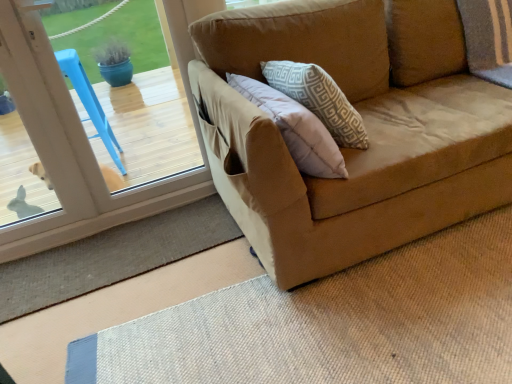
I want to click on burlap mat at lower left, so click(112, 256).

Describe the element at coordinates (112, 256) in the screenshot. I see `burlap mat at lower left` at that location.

This screenshot has width=512, height=384. Describe the element at coordinates (149, 127) in the screenshot. I see `transparent glass door at left` at that location.

Locate an element on the screen. transparent glass door at left is located at coordinates (149, 127).

Locate an element on the screen. burlap mat at lower left is located at coordinates (112, 256).

Considering the positions of objects transparent glass door at left and burlap mat at lower left in the image provided, who is more to the left, transparent glass door at left or burlap mat at lower left?

burlap mat at lower left is more to the left.

Is transparent glass door at left behind burlap mat at lower left?

No, the depth of transparent glass door at left is less than that of burlap mat at lower left.

Does point (165, 160) appear closer or farther from the camera than point (148, 232)?

Point (165, 160) appears to be farther away from the viewer than point (148, 232).

From the image's perspective, which one is positioned lower, transparent glass door at left or burlap mat at lower left?

burlap mat at lower left appears lower in the image.

From a real-world perspective, between transparent glass door at left and burlap mat at lower left, who is vertically lower?

burlap mat at lower left is physically lower.

Considering the relative sizes of transparent glass door at left and burlap mat at lower left in the image provided, is transparent glass door at left thinner than burlap mat at lower left?

Yes, transparent glass door at left is thinner than burlap mat at lower left.

Can you confirm if transparent glass door at left is shorter than burlap mat at lower left?

No, transparent glass door at left is not shorter than burlap mat at lower left.

Who is bigger, transparent glass door at left or burlap mat at lower left?

Bigger between the two is transparent glass door at left.

Consider the image. Do you think transparent glass door at left is within burlap mat at lower left, or outside of it?

transparent glass door at left is not inside burlap mat at lower left, it's outside.

Is transparent glass door at left far away from burlap mat at lower left?

No, there isn't a large distance between transparent glass door at left and burlap mat at lower left.

Is transparent glass door at left facing towards burlap mat at lower left?

Yes.

How many degrees apart are the facing directions of transparent glass door at left and burlap mat at lower left?

There is a 2-degree angle between the facing directions of transparent glass door at left and burlap mat at lower left.

Measure the distance from transparent glass door at left to burlap mat at lower left.

The distance of transparent glass door at left from burlap mat at lower left is 33.00 inches.

At what (x,y) coordinates should I click in order to perform the action: click on window on the right of the burlap mat at lower left. Please return your answer as a coordinate pair (x, y). The width and height of the screenshot is (512, 384). Looking at the image, I should click on (149, 127).

Does burlap mat at lower left appear on the right side of transparent glass door at left?

No, burlap mat at lower left is not to the right of transparent glass door at left.

Which object is closer to the camera, burlap mat at lower left or transparent glass door at left?

Positioned in front is transparent glass door at left.

Which is behind, point (154, 223) or point (56, 209)?

Positioned behind is point (56, 209).

From the image's perspective, is burlap mat at lower left positioned above or below transparent glass door at left?

From the image's perspective, burlap mat at lower left appears below transparent glass door at left.

From a real-world perspective, relative to transparent glass door at left, is burlap mat at lower left vertically above or below?

A: From a real-world perspective, burlap mat at lower left is physically below transparent glass door at left.

Is burlap mat at lower left thinner than transparent glass door at left?

No, burlap mat at lower left is not thinner than transparent glass door at left.

Between burlap mat at lower left and transparent glass door at left, which one has more height?

Standing taller between the two is transparent glass door at left.

Which of these two, burlap mat at lower left or transparent glass door at left, is bigger?

transparent glass door at left.

Consider the image. Would you say burlap mat at lower left is outside transparent glass door at left?

Indeed, burlap mat at lower left is completely outside transparent glass door at left.

Is burlap mat at lower left in contact with transparent glass door at left?

No, burlap mat at lower left is not touching transparent glass door at left.

Could you tell me if burlap mat at lower left is facing transparent glass door at left?

No, burlap mat at lower left is not turned towards transparent glass door at left.

Can you tell me how much burlap mat at lower left and transparent glass door at left differ in facing direction?

burlap mat at lower left and transparent glass door at left are facing 2 degrees away from each other.

What are the coordinates of `doormat behind the transparent glass door at left` in the screenshot? It's located at (112, 256).

I want to click on doormat to the left of transparent glass door at left, so click(112, 256).

The image size is (512, 384). Find the location of `window that appears on the right of burlap mat at lower left`. window that appears on the right of burlap mat at lower left is located at coordinates (149, 127).